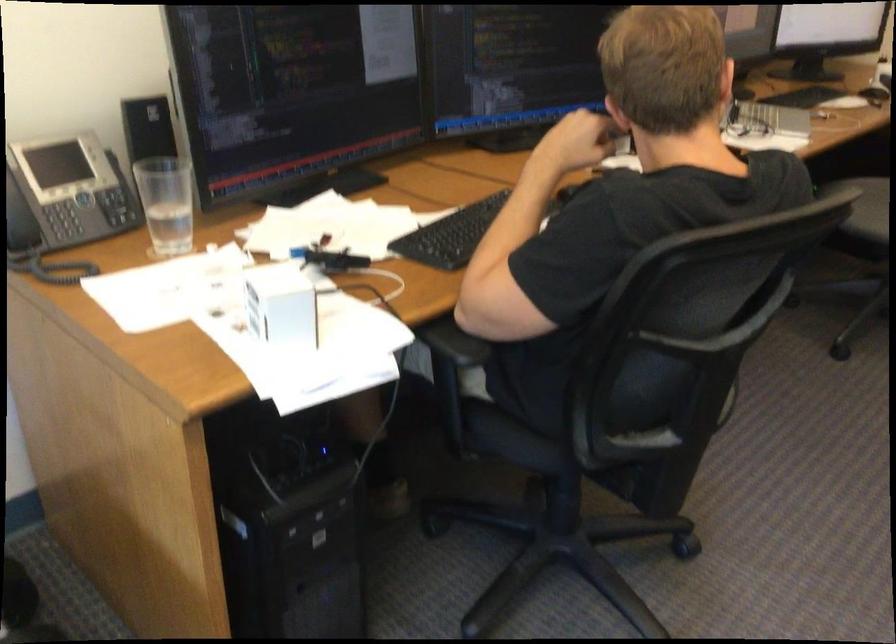
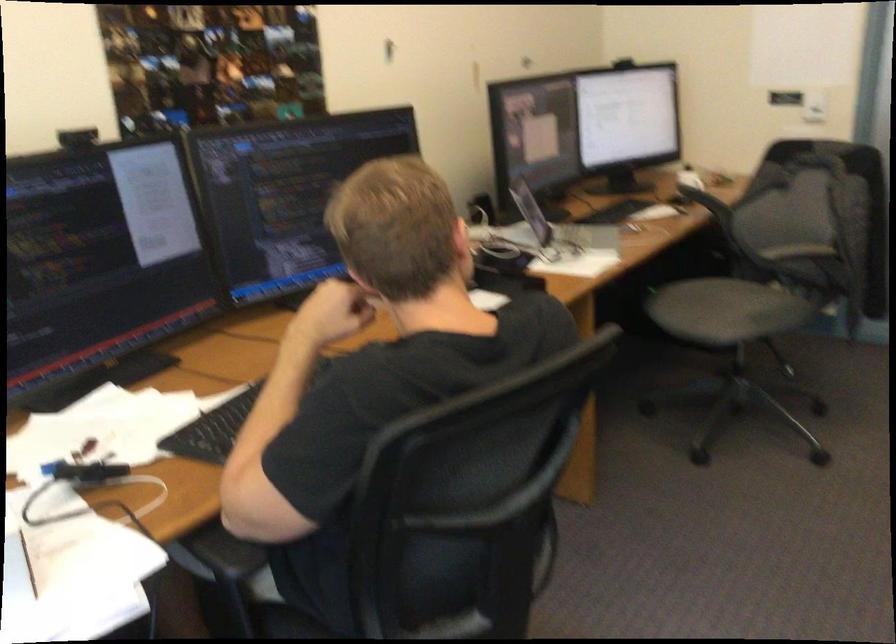
Where in the second image is the point corresponding to point 748,109 from the first image?

(561, 230)